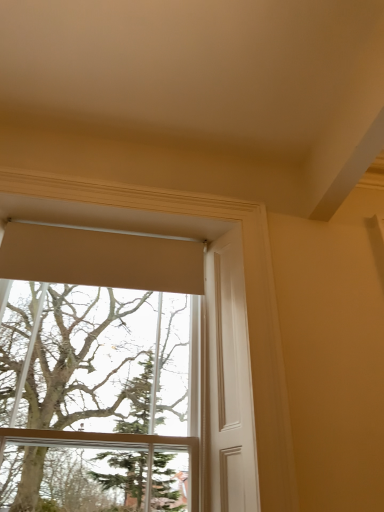
Question: Should I look upward or downward to see matte beige roller blind at upper center?

Choices:
 (A) up
 (B) down

Answer: (B)